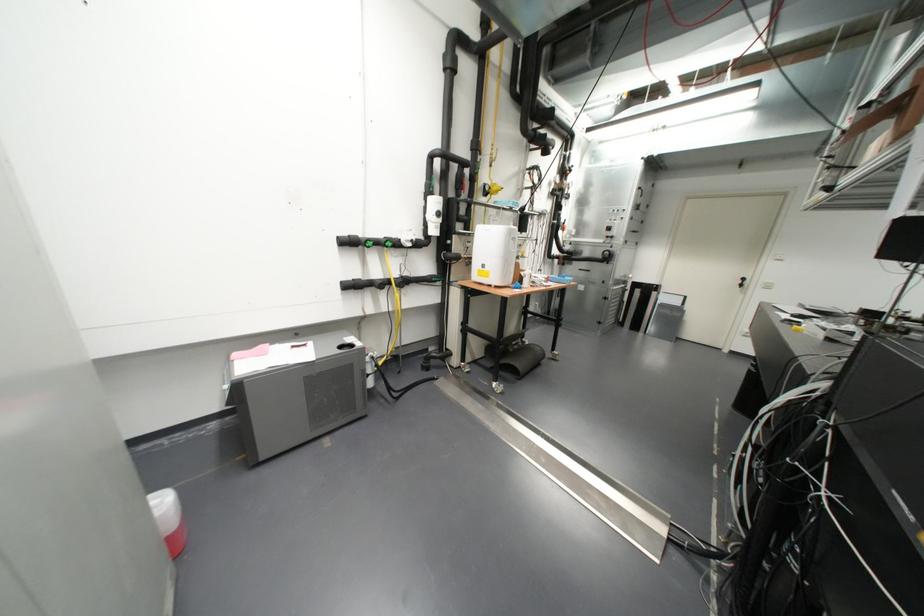
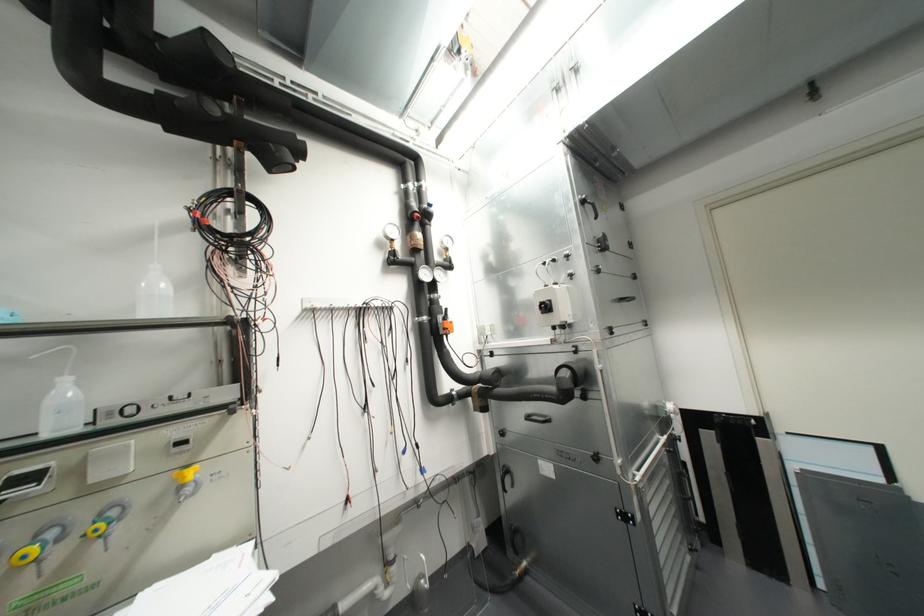
What movement of the cameraman would produce the second image?

The cameraman walked toward right, forward.